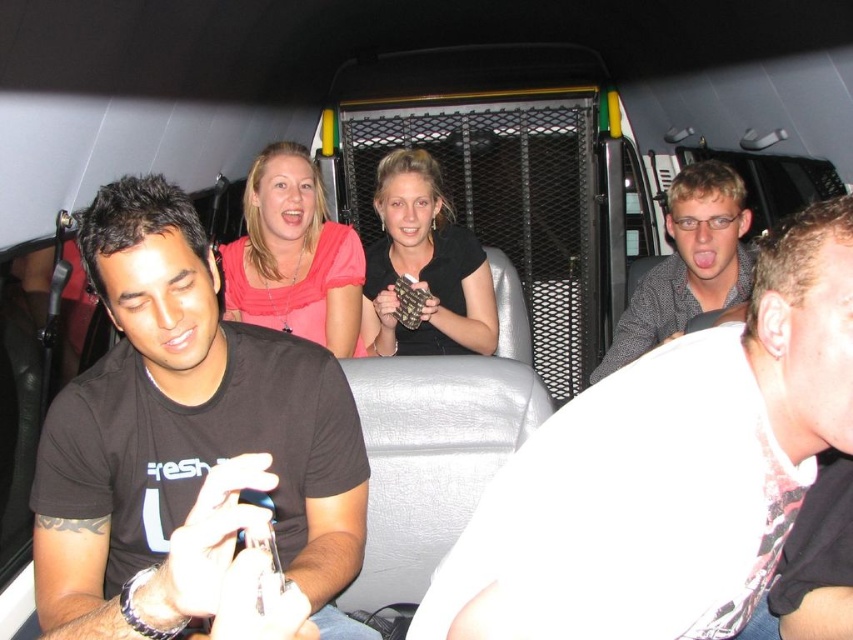
Based on the photo, which is more to the right, black matte t-shirt at left or checkered fabric shirt at right?

Positioned to the right is checkered fabric shirt at right.

Can you confirm if black matte t-shirt at left is positioned below checkered fabric shirt at right?

Yes, black matte t-shirt at left is below checkered fabric shirt at right.

Between point (91, 506) and point (735, 208), which one is positioned behind?

The point (735, 208) is behind.

Identify the location of black matte t-shirt at left. (187, 442).

Can you confirm if black matte necklace at center is shorter than checkered fabric shirt at right?

Incorrect, black matte necklace at center's height does not fall short of checkered fabric shirt at right's.

Between point (399, 349) and point (677, 234), which one is positioned in front?

Point (677, 234) is in front.

Find the location of a particular element. This screenshot has width=853, height=640. black matte necklace at center is located at coordinates (424, 268).

Is black matte t-shirt at left thinner than black matte necklace at center?

No, black matte t-shirt at left is not thinner than black matte necklace at center.

Can you confirm if black matte t-shirt at left is shorter than black matte necklace at center?

No.

At what (x,y) coordinates should I click in order to perform the action: click on black matte t-shirt at left. Please return your answer as a coordinate pair (x, y). The image size is (853, 640). Looking at the image, I should click on (187, 442).

The height and width of the screenshot is (640, 853). Find the location of `black matte t-shirt at left`. black matte t-shirt at left is located at coordinates (187, 442).